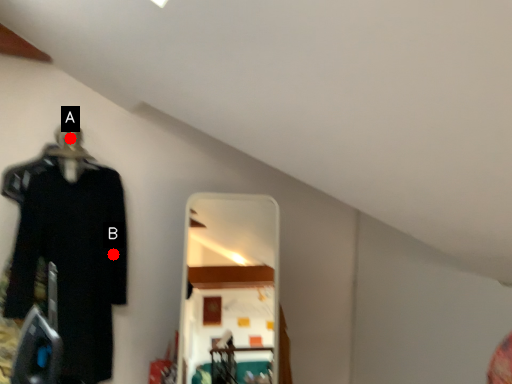
Question: Two points are circled on the image, labeled by A and B beside each circle. Among these points, which one is farthest from the camera?

Choices:
 (A) A is further
 (B) B is further

Answer: (B)